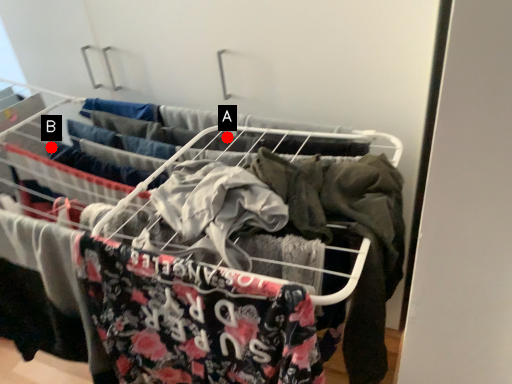
Question: Two points are circled on the image, labeled by A and B beside each circle. Among these points, which one is nearest to the camera?

Choices:
 (A) A is closer
 (B) B is closer

Answer: (A)